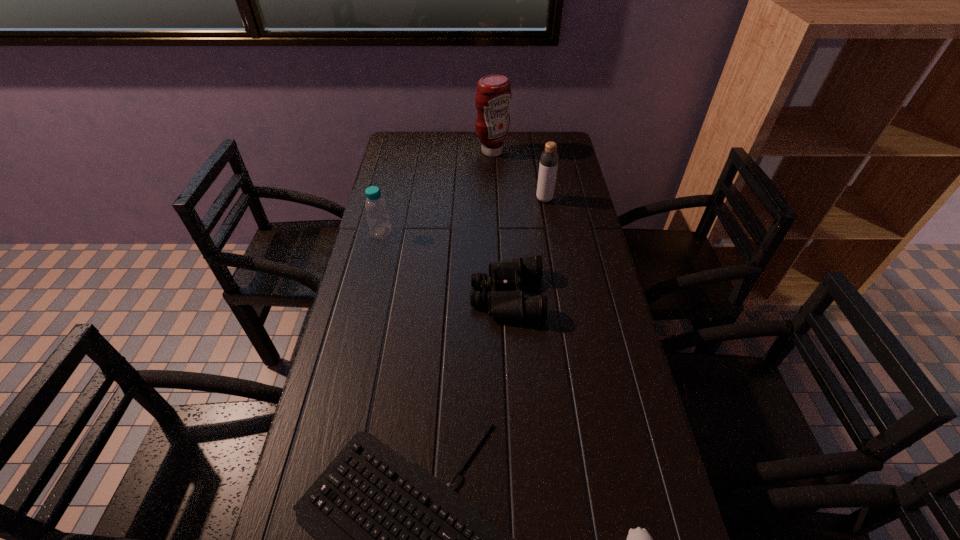
Locate an element on the screen. This screenshot has height=540, width=960. the farthest object is located at coordinates (493, 96).

I want to click on condiment, so pyautogui.click(x=493, y=96).

Where is `the second farthest object`? This screenshot has height=540, width=960. the second farthest object is located at coordinates (549, 158).

Find the location of `the second object from right to left`. the second object from right to left is located at coordinates (549, 158).

I want to click on the fourth shortest object, so click(x=376, y=210).

The width and height of the screenshot is (960, 540). I want to click on the leftmost bottle, so click(376, 210).

Identify the location of the fourth farthest object. pyautogui.click(x=506, y=304).

I want to click on binoculars, so click(506, 304).

Where is `free space located 0.110m on the front of the tallest object`? free space located 0.110m on the front of the tallest object is located at coordinates (493, 175).

This screenshot has height=540, width=960. Identify the location of free space located on the back of the second bottle from left to right. (540, 168).